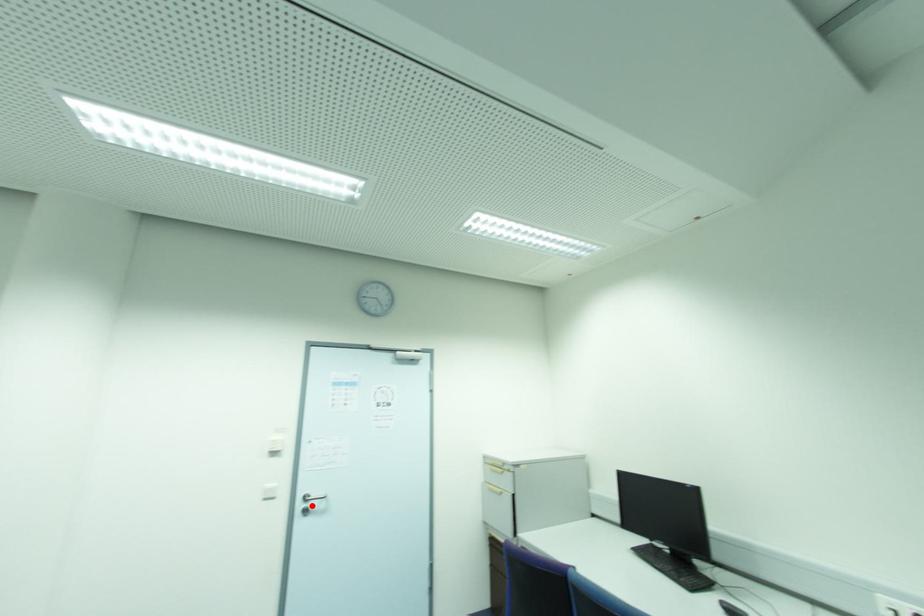
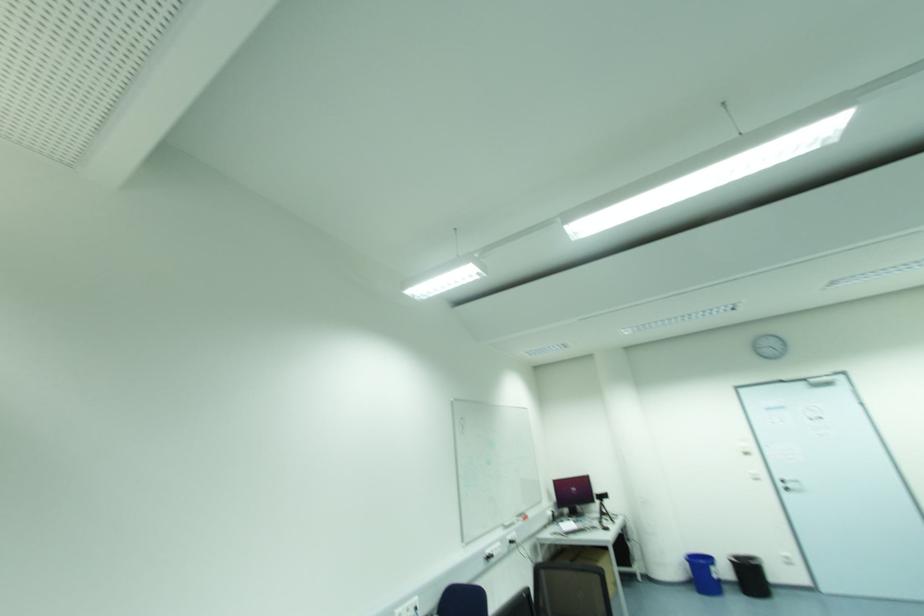
Find the pixel in the second image that matches the highlighted location in the first image.

(789, 485)